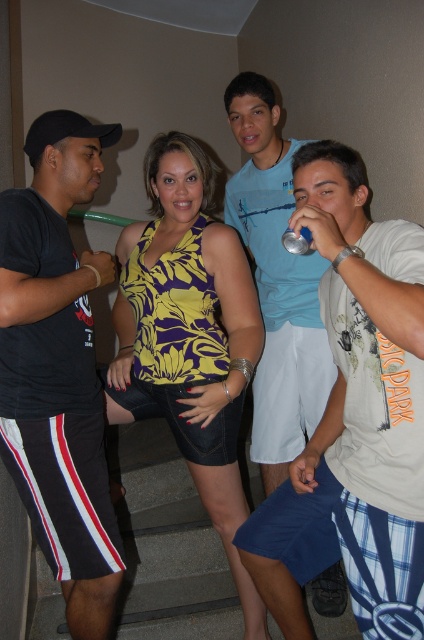
Question: Which object appears closest to the camera in this image?

Choices:
 (A) white cotton shirt at right
 (B) black cotton t-shirt at left
 (C) yellow floral tank top at center

Answer: (A)

Question: Which of the following is the closest to the observer?

Choices:
 (A) click(162, 250)
 (B) click(10, 208)
 (C) click(345, 502)

Answer: (C)

Question: Can you confirm if black cotton t-shirt at left is positioned below light blue cotton shirt at center?

Choices:
 (A) no
 (B) yes

Answer: (B)

Question: Which point is farther from the camera taking this photo?

Choices:
 (A) (325, 381)
 (B) (5, 314)

Answer: (A)

Question: Does white cotton shirt at right have a larger size compared to light blue cotton shirt at center?

Choices:
 (A) no
 (B) yes

Answer: (B)

Question: Does white cotton shirt at right lie behind black cotton t-shirt at left?

Choices:
 (A) no
 (B) yes

Answer: (A)